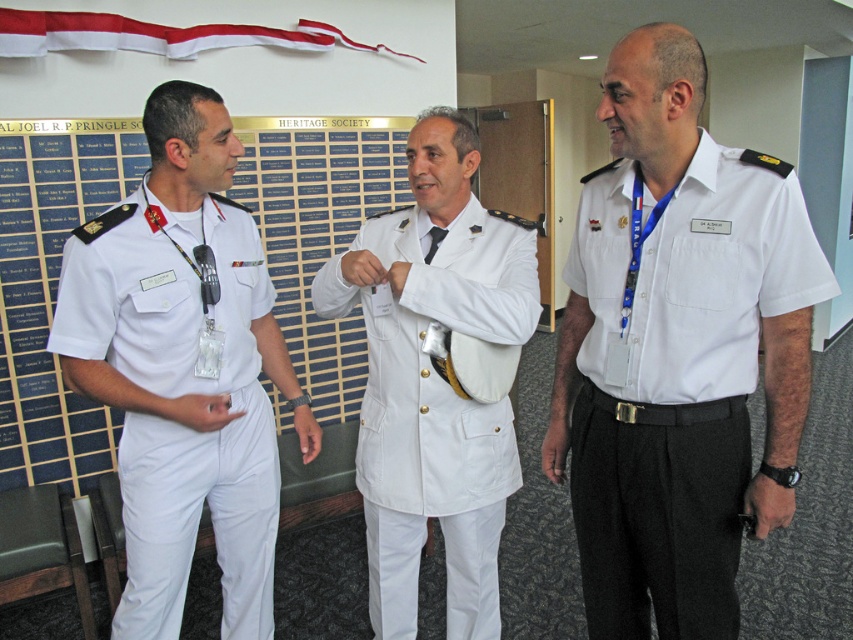
Between point (746, 195) and point (497, 474), which one is positioned in front?

Point (746, 195)

Is point (706, 538) positioned after point (497, 468)?

No, (706, 538) is closer to viewer.

Identify the location of white cotton shirt at center. (676, 378).

Does point (381, 362) lie behind point (167, 42)?

That is False.

How far apart are white matte uniform at center and white fabric ribbon at upper center?

white matte uniform at center and white fabric ribbon at upper center are 5.21 feet apart from each other.

Who is more distant from viewer, (x=387, y=477) or (x=231, y=44)?

Point (x=231, y=44)

You are a GUI agent. You are given a task and a screenshot of the screen. Output one action in this format:
    pyautogui.click(x=<x>, y=<y>)
    Task: Click on the white matte uniform at center
    The width and height of the screenshot is (853, 640).
    Given the screenshot: What is the action you would take?
    pyautogui.click(x=434, y=404)

The height and width of the screenshot is (640, 853). What do you see at coordinates (676, 378) in the screenshot? I see `white cotton shirt at center` at bounding box center [676, 378].

Can you confirm if white cotton shirt at center is bigger than white fabric ribbon at upper center?

No.

Where is `white cotton shirt at center`? Image resolution: width=853 pixels, height=640 pixels. white cotton shirt at center is located at coordinates (676, 378).